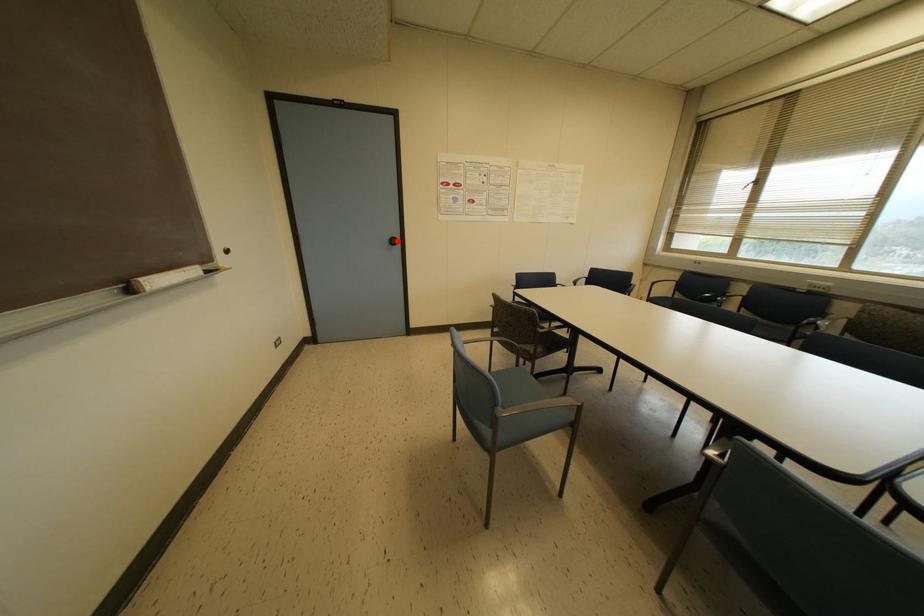
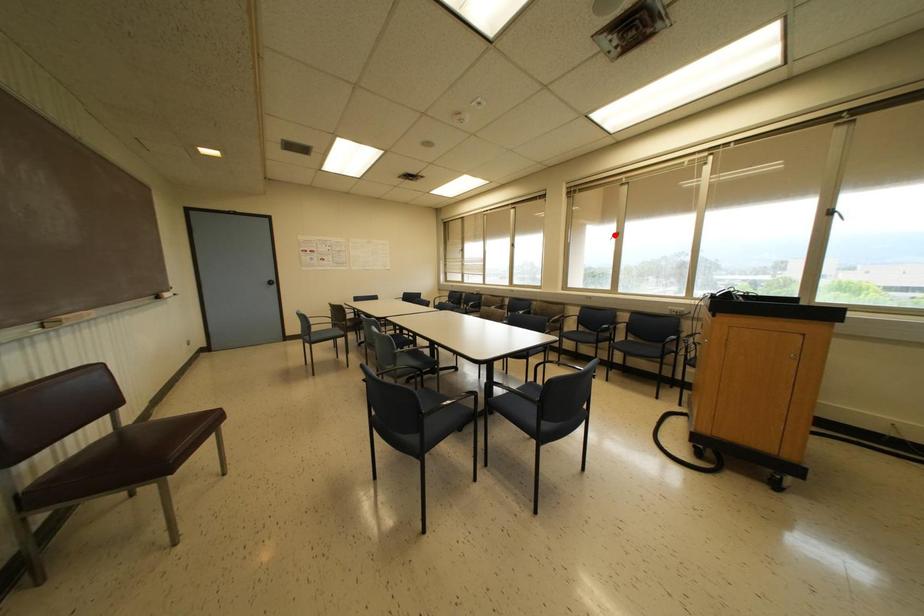
I am providing you with two images of the same scene from different viewpoints. A red point is marked on the first image and another point is marked on the second image. Is the marked point in image1 the same physical position as the marked point in image2?

No